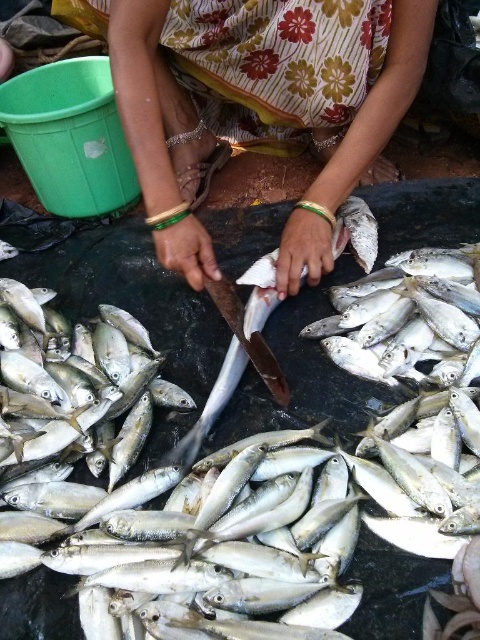
You are a customer at the market and want to buy the shiny silver fish at center. The vendor is standing behind the floral fabric skirt at center. Can you see the fish from where you are standing?

The floral fabric skirt at center is much taller than the shiny silver fish at center, so the skirt may block your view of the fish.

You are standing at the origin point in the scene. Which of the two points, point (339, 86) or point (371, 227), is closer to you?

Point (339, 86) is in front of point (371, 227), so it is closer to you.

You are a tailor trying to decide whether to use the floral fabric skirt at center to cover a shiny silver fish at center. Based on their sizes, will the skirt fabric be sufficient to cover the fish?

The floral fabric skirt at center has a larger width than the shiny silver fish at center, so the fabric should be sufficient to cover the fish.